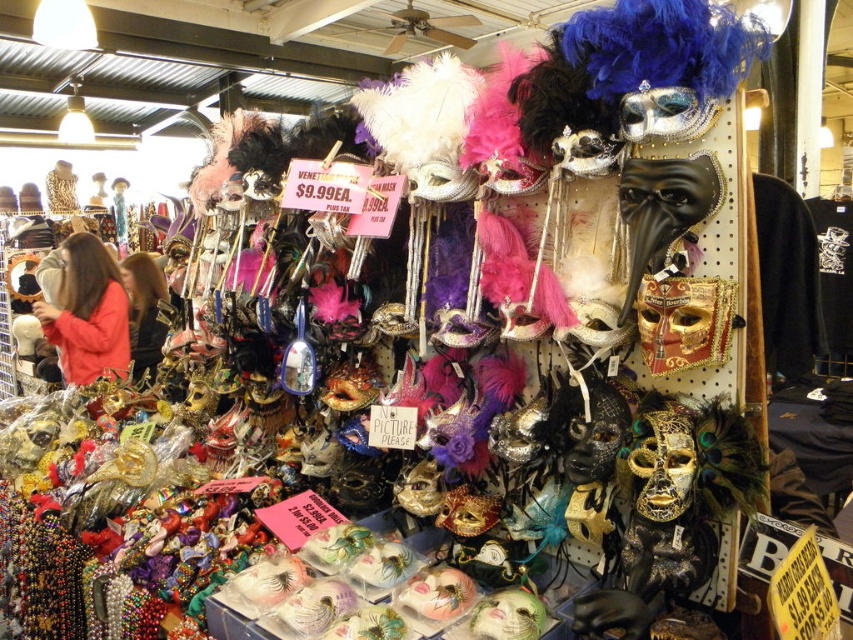
Is matte pink mask at upper left to the right of dark brown leather jacket at center from the viewer's perspective?

In fact, matte pink mask at upper left is to the left of dark brown leather jacket at center.

Between point (67, 272) and point (138, 316), which one is positioned behind?

Positioned behind is point (138, 316).

Is point (62, 365) positioned in front of point (163, 332)?

Yes, point (62, 365) is in front of point (163, 332).

You are a GUI agent. You are given a task and a screenshot of the screen. Output one action in this format:
    pyautogui.click(x=<x>, y=<y>)
    Task: Click on the matte pink mask at upper left
    This screenshot has height=640, width=853.
    Given the screenshot: What is the action you would take?
    pyautogui.click(x=86, y=312)